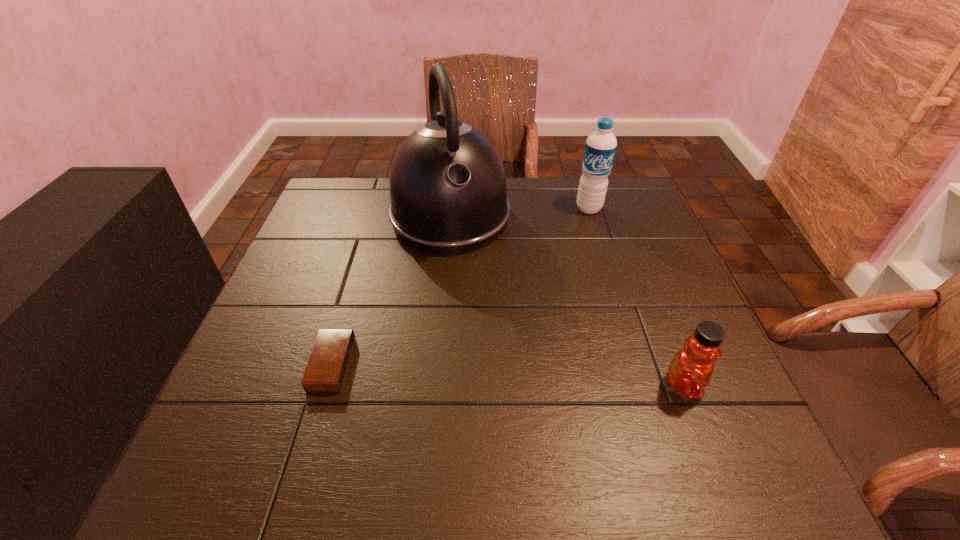
Where is `the shortest object`? The height and width of the screenshot is (540, 960). the shortest object is located at coordinates 328,363.

This screenshot has width=960, height=540. I want to click on the leftmost object, so click(328, 363).

Where is `honey`? This screenshot has height=540, width=960. honey is located at coordinates (690, 371).

Identify the location of the rightmost object. The image size is (960, 540). (690, 371).

Find the location of a particular element. The image size is (960, 540). kettle is located at coordinates (448, 194).

Where is `the third object from right to left`? This screenshot has width=960, height=540. the third object from right to left is located at coordinates (448, 194).

Identify the location of the second object from right to left. The height and width of the screenshot is (540, 960). (600, 148).

Identify the location of the third shortest object. (600, 148).

The image size is (960, 540). In order to click on free space located on the front face of the alarm clock in this screenshot , I will do [x=379, y=364].

Where is `free region located 0.260m on the spout of the kettle`? free region located 0.260m on the spout of the kettle is located at coordinates (488, 339).